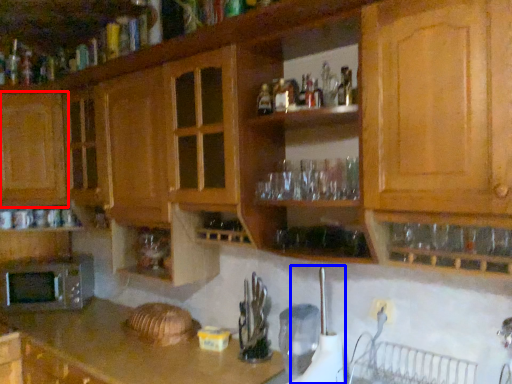
Question: Which of the following is the farthest to the observer, cabinetry (highlighted by a red box) or appliance (highlighted by a blue box)?

Choices:
 (A) cabinetry
 (B) appliance

Answer: (A)